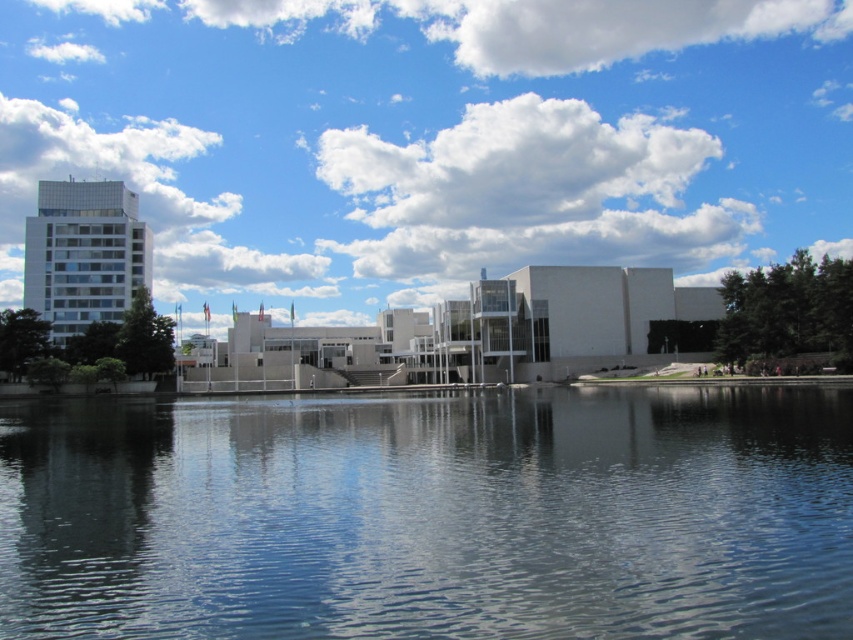
Is clear blue water at center in front of white fluffy cloud at upper center?

That is True.

The width and height of the screenshot is (853, 640). I want to click on clear blue water at center, so click(430, 515).